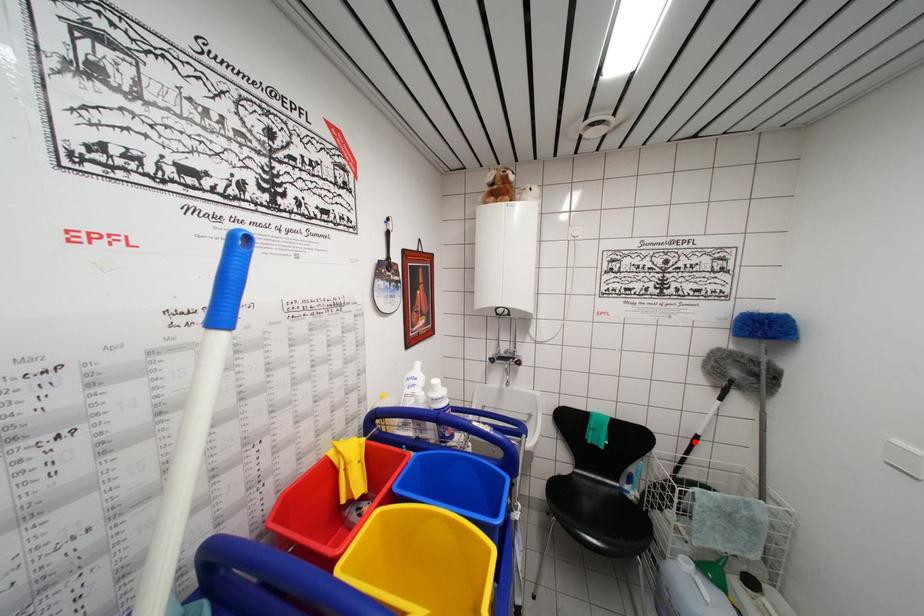
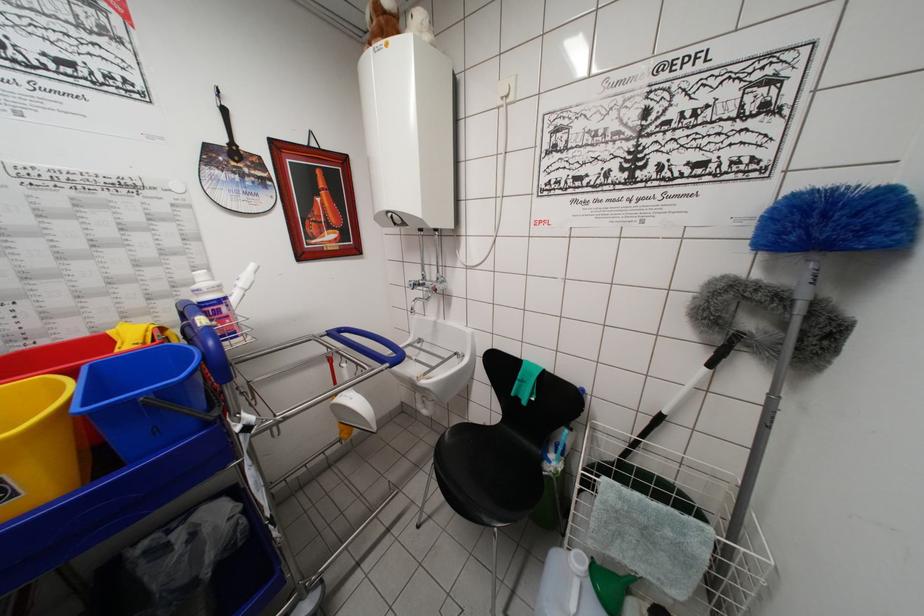
Locate, in the second image, the point that corresponds to the highlighted location in the first image.

(658, 419)